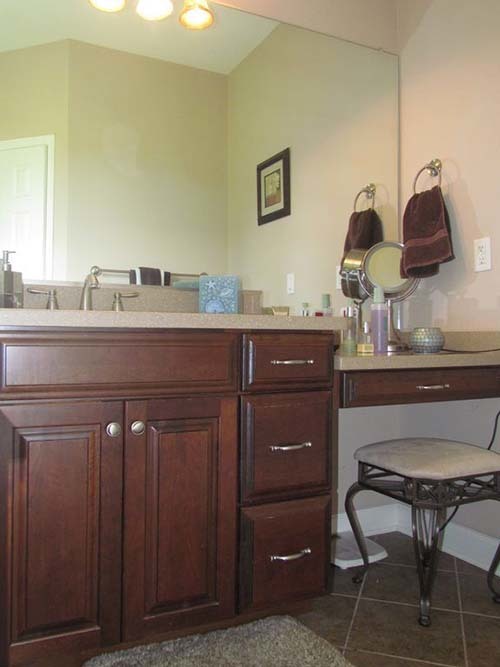
The height and width of the screenshot is (667, 500). What are the coordinates of `cabinet doors` in the screenshot? It's located at (64, 485), (181, 495).